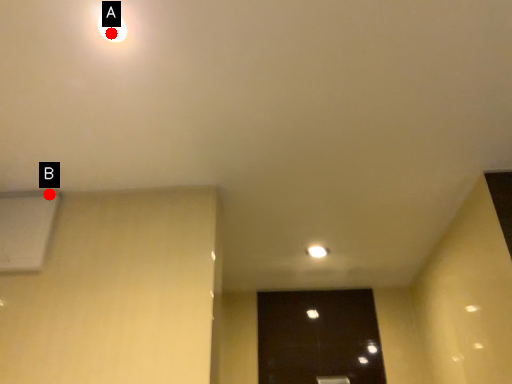
Question: Two points are circled on the image, labeled by A and B beside each circle. Which point is closer to the camera?

Choices:
 (A) A is closer
 (B) B is closer

Answer: (A)